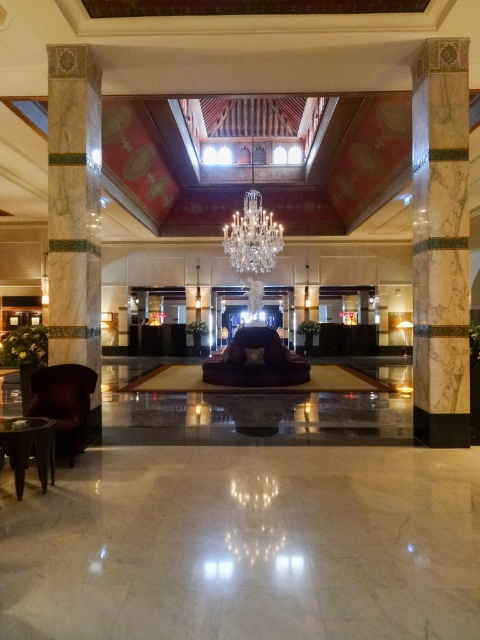
Question: Which object is closer to the camera taking this photo?

Choices:
 (A) velvet purple armchair at center
 (B) marble column at right
 (C) marble column at left

Answer: (C)

Question: Does velvet purple armchair at center have a smaller size compared to crystal glass chandelier at center?

Choices:
 (A) yes
 (B) no

Answer: (A)

Question: Which of the following is the closest to the observer?

Choices:
 (A) marble column at right
 (B) crystal glass chandelier at center
 (C) velvet purple armchair at center

Answer: (A)

Question: Is marble column at right smaller than velvet purple armchair at center?

Choices:
 (A) yes
 (B) no

Answer: (A)

Question: Does velvet purple armchair at center appear on the left side of velvet armchair at left?

Choices:
 (A) yes
 (B) no

Answer: (B)

Question: Which object is the closest to the marble column at left?

Choices:
 (A) velvet purple armchair at center
 (B) velvet armchair at left
 (C) crystal glass chandelier at center
 (D) marble column at right

Answer: (B)